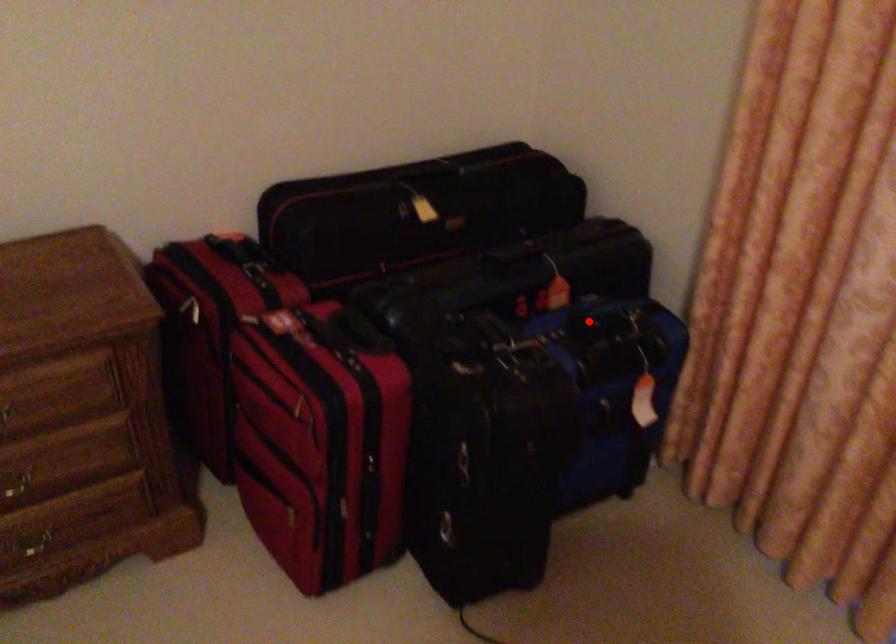
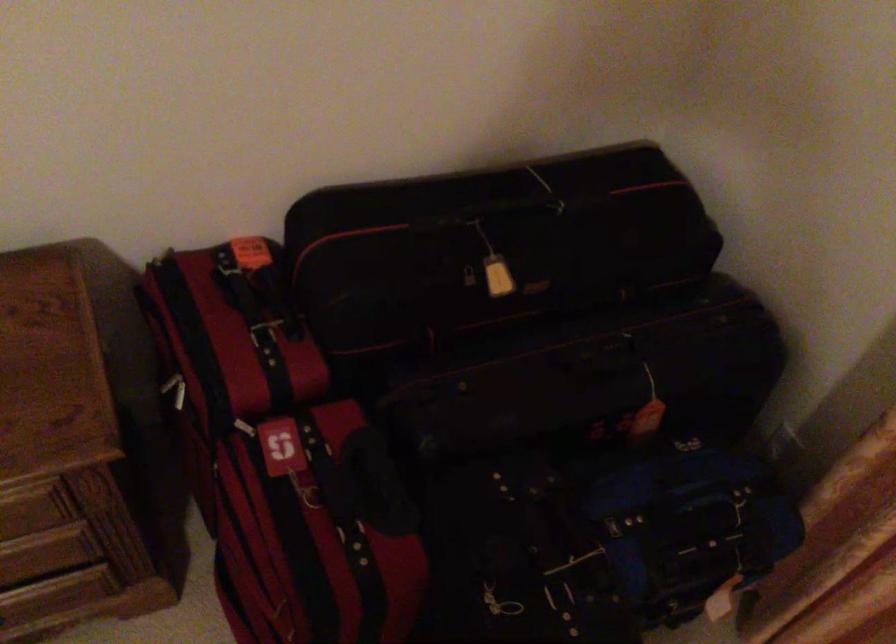
Question: I am providing you with two images of the same scene from different viewpoints. Given a red point in image1, look at the same physical point in image2. Is it:

Choices:
 (A) Closer to the viewpoint
 (B) Farther from the viewpoint

Answer: (A)